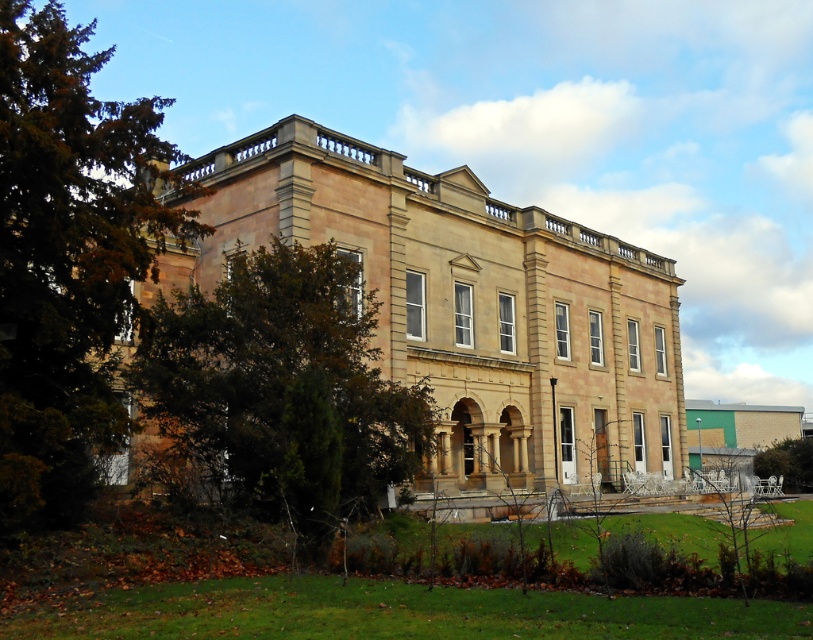
Question: Is beige stone palace at center wider than beige stone mansion at center?

Choices:
 (A) yes
 (B) no

Answer: (B)

Question: Considering the relative positions of brown wood tree at left and green leafy tree at left in the image provided, where is brown wood tree at left located with respect to green leafy tree at left?

Choices:
 (A) above
 (B) below

Answer: (A)

Question: Considering the real-world distances, which object is farthest from the beige stone palace at center?

Choices:
 (A) beige stone mansion at center
 (B) green leafy tree at left
 (C) brown wood tree at left
 (D) green leafy tree at lower right

Answer: (D)

Question: Which of the following is the closest to the observer?

Choices:
 (A) (70, 124)
 (B) (442, 192)

Answer: (A)

Question: Is beige stone mansion at center further to the viewer compared to green leafy tree at lower right?

Choices:
 (A) no
 (B) yes

Answer: (A)

Question: Which point appears closest to the camera in this image?

Choices:
 (A) (759, 404)
 (B) (344, 260)
 (C) (801, 483)

Answer: (B)